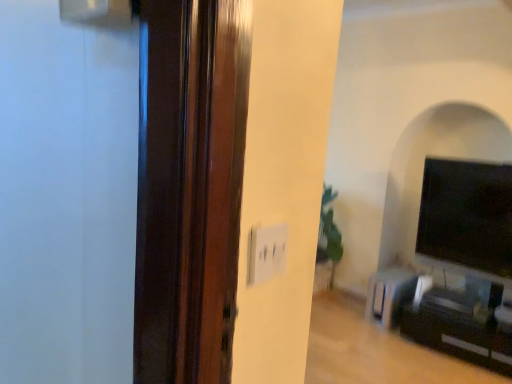
Question: Does black glossy entertainment center at lower right appear on the left side of metallic silver speaker at lower right?

Choices:
 (A) no
 (B) yes

Answer: (A)

Question: Considering the relative sizes of black glossy entertainment center at lower right and metallic silver speaker at lower right in the image provided, is black glossy entertainment center at lower right taller than metallic silver speaker at lower right?

Choices:
 (A) yes
 (B) no

Answer: (B)

Question: Considering the relative positions of black glossy entertainment center at lower right and metallic silver speaker at lower right in the image provided, is black glossy entertainment center at lower right to the right of metallic silver speaker at lower right from the viewer's perspective?

Choices:
 (A) yes
 (B) no

Answer: (A)

Question: Is black glossy entertainment center at lower right placed right next to metallic silver speaker at lower right?

Choices:
 (A) yes
 (B) no

Answer: (B)

Question: Would you say black glossy entertainment center at lower right is a long distance from metallic silver speaker at lower right?

Choices:
 (A) no
 (B) yes

Answer: (A)

Question: Which is correct: black glossy entertainment center at lower right is inside black glossy tv at right, or outside of it?

Choices:
 (A) outside
 (B) inside

Answer: (A)

Question: From the image's perspective, is black glossy entertainment center at lower right located above or below black glossy tv at right?

Choices:
 (A) below
 (B) above

Answer: (A)

Question: Is black glossy entertainment center at lower right wider or thinner than black glossy tv at right?

Choices:
 (A) thin
 (B) wide

Answer: (B)

Question: Considering their positions, is black glossy entertainment center at lower right located in front of or behind black glossy tv at right?

Choices:
 (A) behind
 (B) front

Answer: (B)

Question: Relative to metallic silver speaker at lower right, is black glossy tv at right in front or behind?

Choices:
 (A) behind
 (B) front

Answer: (B)

Question: Considering the positions of point (480, 253) and point (369, 286), is point (480, 253) closer or farther from the camera than point (369, 286)?

Choices:
 (A) farther
 (B) closer

Answer: (B)

Question: Is black glossy tv at right wider or thinner than metallic silver speaker at lower right?

Choices:
 (A) thin
 (B) wide

Answer: (A)

Question: Considering the positions of black glossy tv at right and metallic silver speaker at lower right in the image, is black glossy tv at right bigger or smaller than metallic silver speaker at lower right?

Choices:
 (A) big
 (B) small

Answer: (A)

Question: Does point (375, 316) appear closer or farther from the camera than point (442, 261)?

Choices:
 (A) closer
 (B) farther

Answer: (B)

Question: Considering the positions of metallic silver speaker at lower right and black glossy tv at right in the image, is metallic silver speaker at lower right taller or shorter than black glossy tv at right?

Choices:
 (A) short
 (B) tall

Answer: (A)